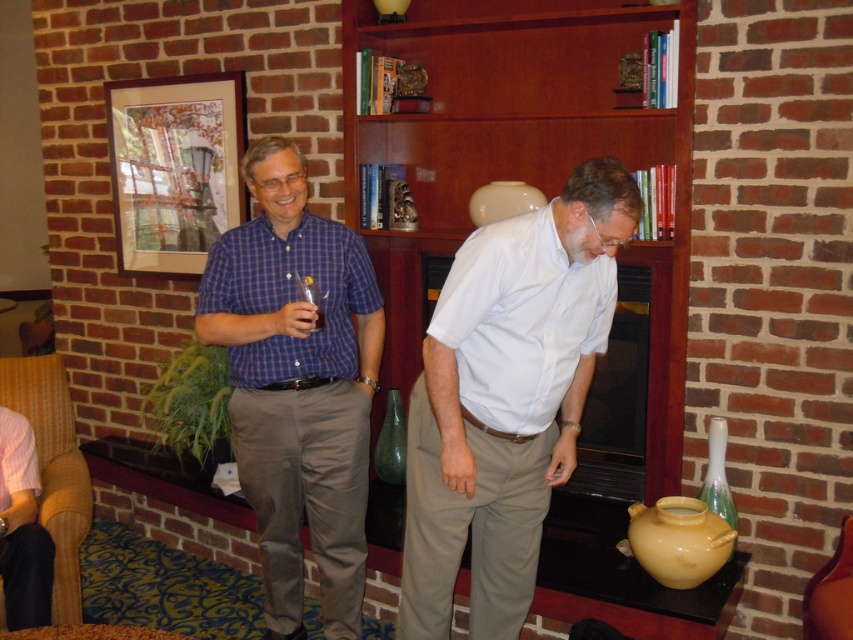
Does point (537, 177) come behind point (642, 288)?

Yes, point (537, 177) is behind point (642, 288).

Between point (582, 48) and point (611, 436), which one is positioned in front?

Point (582, 48)

Is point (643, 444) positioned behind point (627, 458)?

No, (643, 444) is closer to viewer.

The height and width of the screenshot is (640, 853). I want to click on wooden bookshelf at center, so click(534, 186).

Does point (48, 438) lie in front of point (810, 580)?

No, it is behind (810, 580).

Based on the photo, does brown fabric armchair at lower left have a lesser width compared to leather armchair at lower right?

Incorrect, brown fabric armchair at lower left's width is not less than leather armchair at lower right's.

Is point (74, 513) positioned in front of point (846, 609)?

No.

What are the coordinates of `brown fabric armchair at lower left` in the screenshot? It's located at (44, 474).

Is point (332, 387) positioned before point (843, 516)?

No, (332, 387) is behind (843, 516).

Which of these two, blue plaid shirt at center or leather armchair at lower right, stands shorter?

Standing shorter between the two is leather armchair at lower right.

The image size is (853, 640). I want to click on blue plaid shirt at center, so click(297, 385).